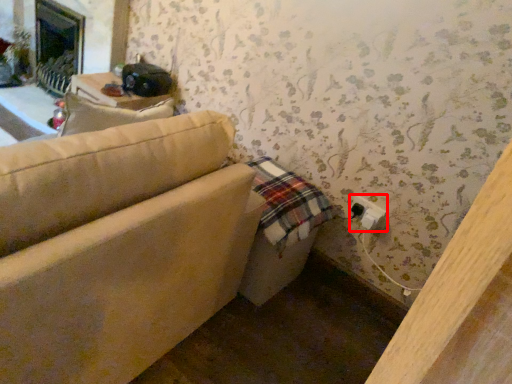
Question: Where is electric outlet (annotated by the red box) located in relation to studio couch in the image?

Choices:
 (A) right
 (B) left

Answer: (A)